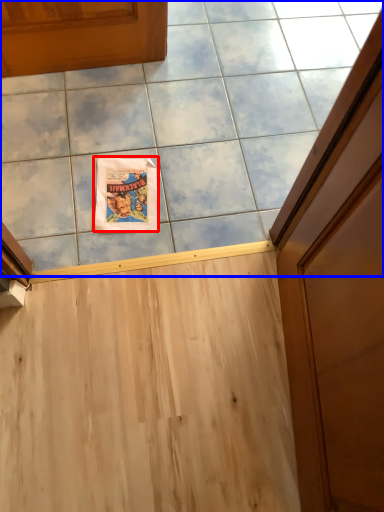
Question: Among these objects, which one is farthest to the camera, comic book (highlighted by a red box) or ceramic tile (highlighted by a blue box)?

Choices:
 (A) comic book
 (B) ceramic tile

Answer: (A)